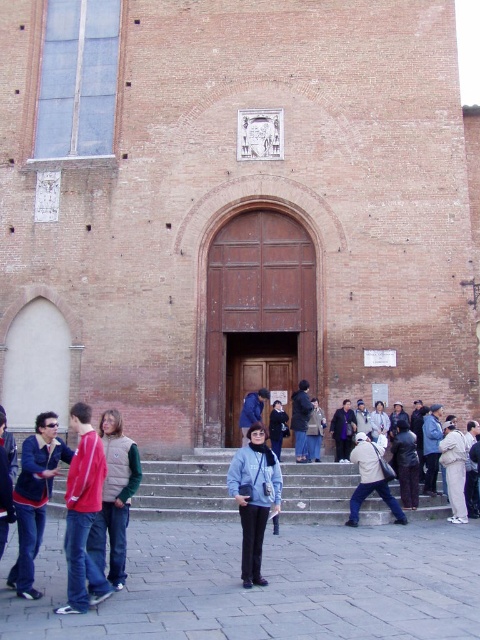
Is white cotton shirt at center to the left of dark gray jacket at center from the viewer's perspective?

In fact, white cotton shirt at center is to the right of dark gray jacket at center.

Does point (364, 460) come closer to viewer compared to point (304, 384)?

Yes, point (364, 460) is in front of point (304, 384).

Which is in front, point (359, 458) or point (300, 451)?

Point (359, 458) is in front.

You are a GUI agent. You are given a task and a screenshot of the screen. Output one action in this format:
    pyautogui.click(x=<x>, y=<y>)
    Task: Click on the white cotton shirt at center
    
    Given the screenshot: What is the action you would take?
    pyautogui.click(x=371, y=480)

Does dark gray jacket at center have a lesser width compared to dark blue fabric coat at center?

Yes.

Identify the location of dark gray jacket at center. (300, 419).

Image resolution: width=480 pixels, height=640 pixels. Find the location of `dark gray jacket at center`. dark gray jacket at center is located at coordinates (300, 419).

Is dark gray jacket at center in front of dark blue fabric jacket at center?

Yes.

Can you confirm if dark gray jacket at center is taller than dark blue fabric jacket at center?

Yes, dark gray jacket at center is taller than dark blue fabric jacket at center.

Is point (300, 380) behind point (282, 419)?

Yes, point (300, 380) is farther from viewer.

Where is `dark gray jacket at center`? This screenshot has height=640, width=480. dark gray jacket at center is located at coordinates (300, 419).